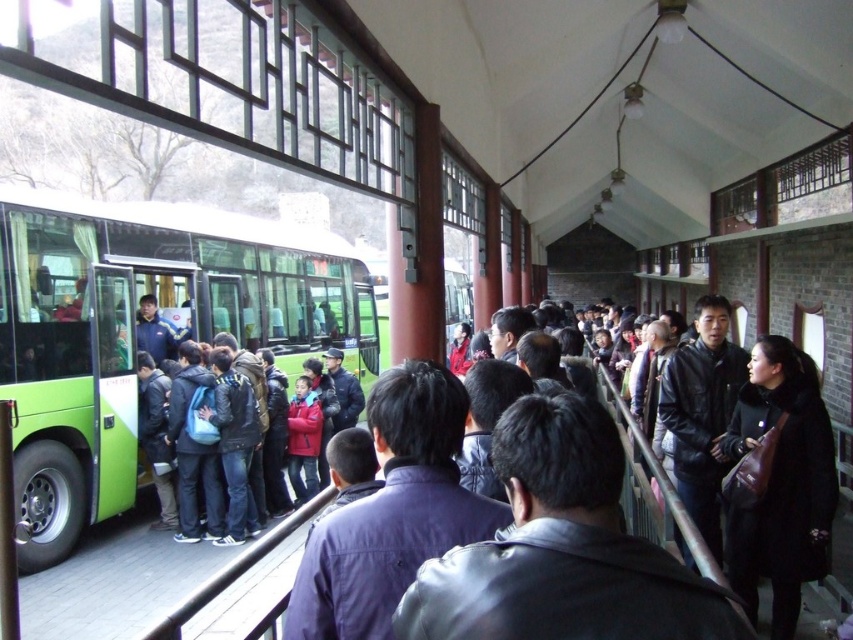
Does green matte bus at left have a greater height compared to dark blue leather jacket at center?

Indeed, green matte bus at left has a greater height compared to dark blue leather jacket at center.

Which is above, green matte bus at left or dark blue leather jacket at center?

green matte bus at left

Which is behind, point (350, 259) or point (473, 632)?

Positioned behind is point (350, 259).

At what (x,y) coordinates should I click in order to perform the action: click on green matte bus at left. Please return your answer as a coordinate pair (x, y). The height and width of the screenshot is (640, 853). Looking at the image, I should click on (134, 332).